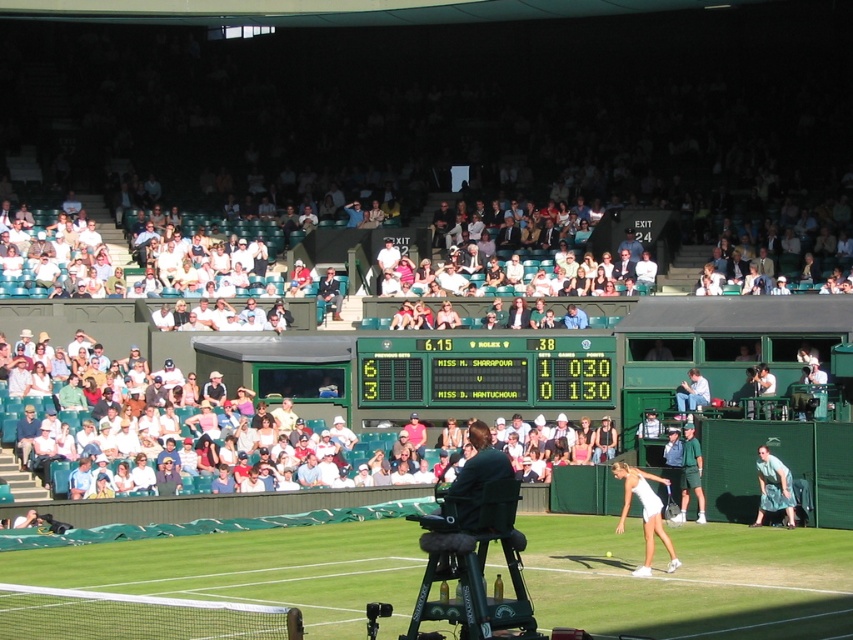
You are a Wimbledon official who needs to hang a banner exactly halfway between the green plastic scoreboard at center and the white matte tennis racket at lower right. Which object will the banner be closer to?

The banner will be closer to the green plastic scoreboard at center because it is shorter than the white matte tennis racket at lower right, so halfway between them would place it nearer to the shorter object.

You are a spectator at Wimbledon watching the tennis match. You notice a point marked at coordinates [485,371]. Can you tell me what object this point is located on?

The point marked at coordinates [485,371] is located on the green plastic scoreboard at center.